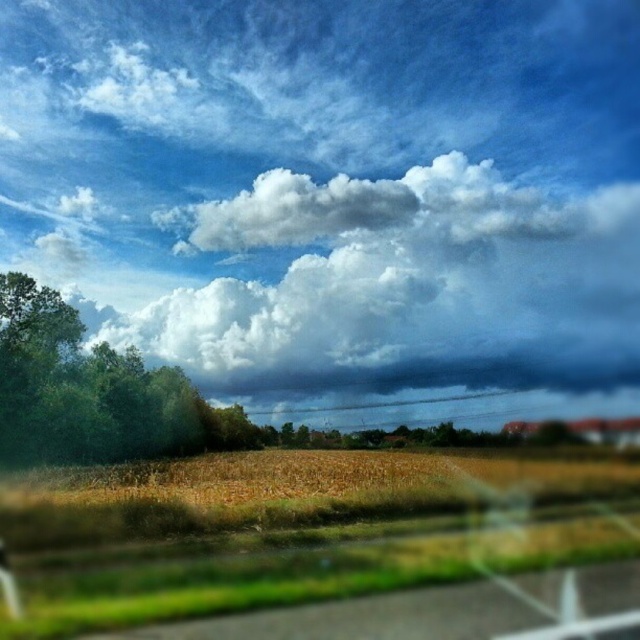
Is white fluffy cloud at upper center closer to the viewer compared to green leafy tree at left?

No, it is not.

Who is lower down, white fluffy cloud at upper center or green leafy tree at left?

Positioned lower is green leafy tree at left.

Between point (557, 198) and point (96, 433), which one is positioned behind?

Point (557, 198)

Locate an element on the screen. Image resolution: width=640 pixels, height=640 pixels. white fluffy cloud at upper center is located at coordinates click(401, 289).